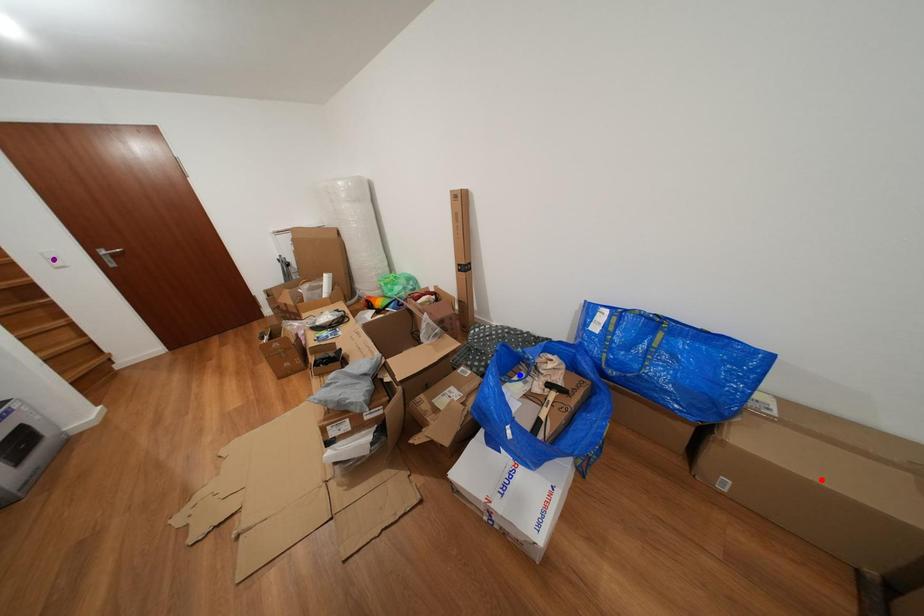
Order these from nearest to farthest:
blue point, red point, purple point

1. purple point
2. blue point
3. red point